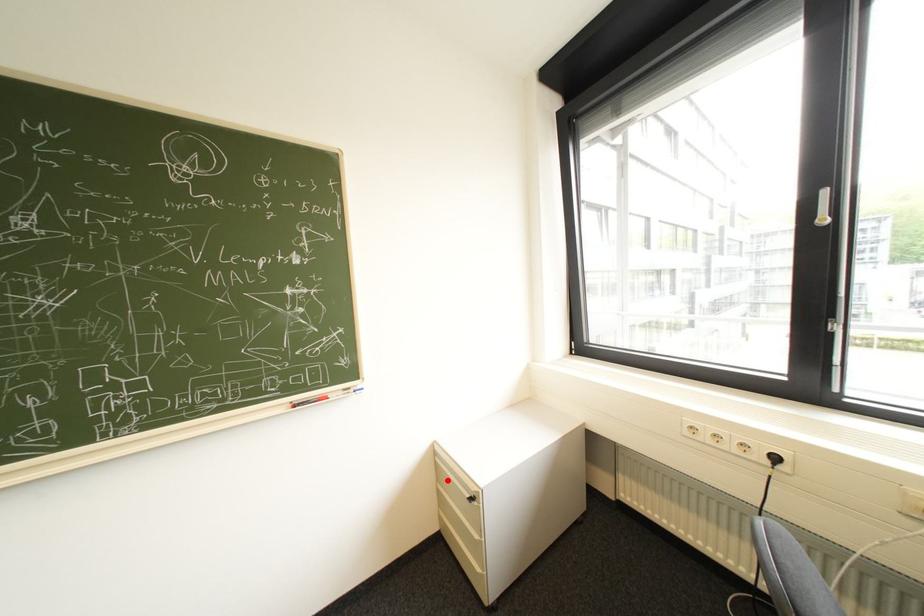
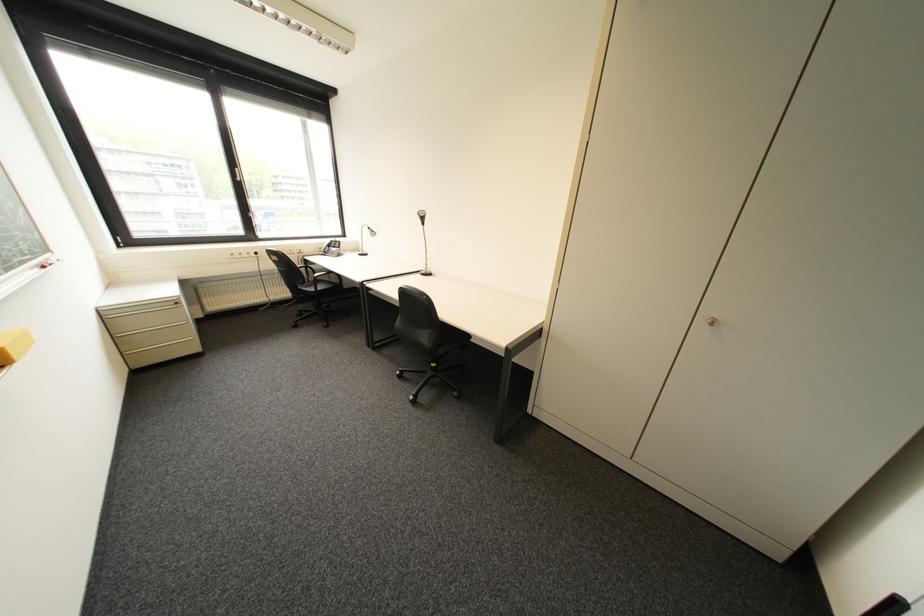
Question: I am providing you with two images of the same scene from different viewpoints. Image1 has a red point marked. In image2, the corresponding 3D location appears at what relative position? Reply with the corresponding letter.

Choices:
 (A) Closer
 (B) Farther

Answer: (A)